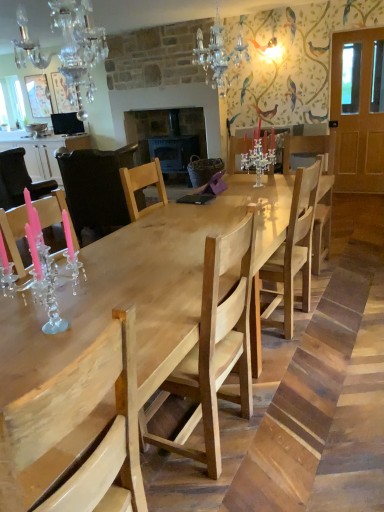
Question: Should I look upward or downward to see natural wood chair at center, which is the 3th chair in front-to-back order?

Choices:
 (A) down
 (B) up

Answer: (B)

Question: Can you confirm if natural wood chair at center, which is the 3th chair in front-to-back order, is positioned to the left of white glossy cabinet at left?

Choices:
 (A) yes
 (B) no

Answer: (B)

Question: Is natural wood chair at center, marked as the 4th chair in a back-to-front arrangement, shorter than white glossy cabinet at left?

Choices:
 (A) yes
 (B) no

Answer: (B)

Question: Is white glossy cabinet at left surrounded by natural wood chair at center, marked as the 4th chair in a back-to-front arrangement?

Choices:
 (A) yes
 (B) no

Answer: (B)

Question: From the image's perspective, would you say natural wood chair at center, marked as the 4th chair in a back-to-front arrangement, is shown under white glossy cabinet at left?

Choices:
 (A) yes
 (B) no

Answer: (A)

Question: From the image's perspective, is natural wood chair at center, which is the 3th chair in front-to-back order, above white glossy cabinet at left?

Choices:
 (A) no
 (B) yes

Answer: (A)

Question: Is natural wood chair at center, marked as the 4th chair in a back-to-front arrangement, smaller than white glossy cabinet at left?

Choices:
 (A) yes
 (B) no

Answer: (A)

Question: From the image's perspective, is clear crystal candelabra at center, which is counted as the third chair, starting from the back, located beneath crystal chandelier at upper left, the 2th light fixture in the top-to-bottom sequence?

Choices:
 (A) yes
 (B) no

Answer: (B)

Question: Considering the relative sizes of clear crystal candelabra at center, which is counted as the third chair, starting from the back, and crystal chandelier at upper left, the 1th light fixture positioned from the bottom, in the image provided, is clear crystal candelabra at center, which is counted as the third chair, starting from the back, shorter than crystal chandelier at upper left, the 1th light fixture positioned from the bottom,?

Choices:
 (A) yes
 (B) no

Answer: (B)

Question: Is clear crystal candelabra at center, placed as the fourth chair when sorted from front to back, in contact with crystal chandelier at upper left, arranged as the 2th light fixture when viewed from the right?

Choices:
 (A) yes
 (B) no

Answer: (B)

Question: Is clear crystal candelabra at center, which is counted as the third chair, starting from the back, further to camera compared to crystal chandelier at upper left, the 2th light fixture in the top-to-bottom sequence?

Choices:
 (A) yes
 (B) no

Answer: (A)

Question: Can you confirm if clear crystal candelabra at center, which is counted as the third chair, starting from the back, is thinner than crystal chandelier at upper left, the 1th light fixture positioned from the bottom?

Choices:
 (A) no
 (B) yes

Answer: (B)

Question: Does clear crystal candelabra at center, placed as the fourth chair when sorted from front to back, appear on the left side of crystal chandelier at upper left, arranged as the 2th light fixture when viewed from the right?

Choices:
 (A) no
 (B) yes

Answer: (A)

Question: Does white glossy cabinet at left have a greater height compared to clear crystal candelabra at center, placed as the fourth chair when sorted from front to back?

Choices:
 (A) yes
 (B) no

Answer: (A)